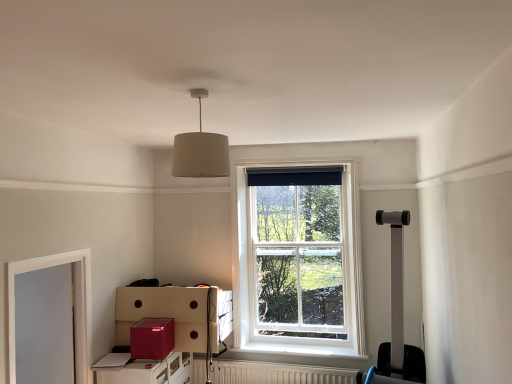
Identify the location of free space above dark blue fabric at upper center (from a real-world perspective). This screenshot has height=384, width=512. (292, 168).